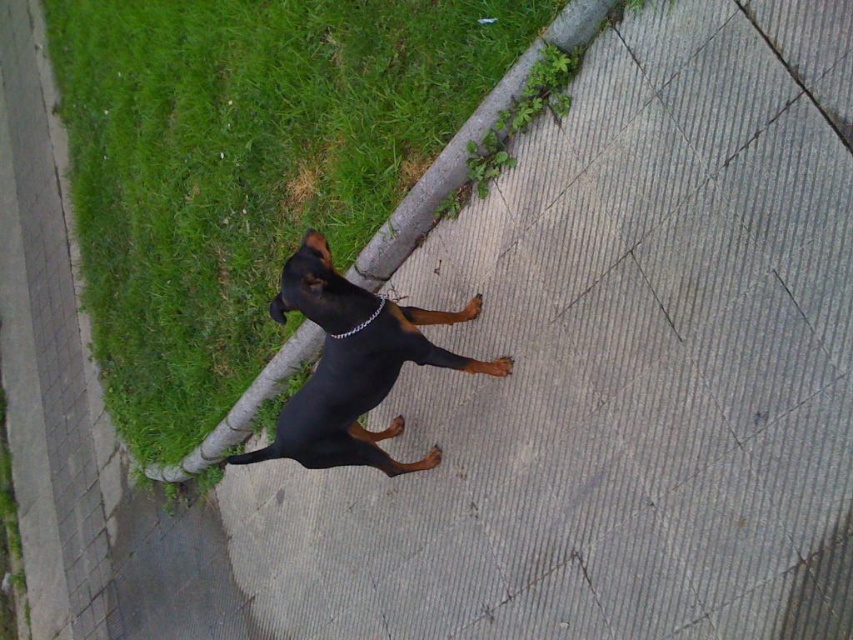
Question: Which of the following is the farthest from the observer?

Choices:
 (A) silver metallic chain at center
 (B) green grass at upper left
 (C) black smooth dog at center

Answer: (B)

Question: Based on their relative distances, which object is farther from the green grass at upper left?

Choices:
 (A) silver metallic chain at center
 (B) black smooth dog at center

Answer: (A)

Question: Can you confirm if green grass at upper left is smaller than silver metallic chain at center?

Choices:
 (A) yes
 (B) no

Answer: (B)

Question: From the image, what is the correct spatial relationship of green grass at upper left in relation to silver metallic chain at center?

Choices:
 (A) below
 (B) above

Answer: (B)

Question: Can you confirm if green grass at upper left is wider than silver metallic chain at center?

Choices:
 (A) yes
 (B) no

Answer: (A)

Question: Which of the following is the farthest from the observer?

Choices:
 (A) click(310, 280)
 (B) click(404, 141)

Answer: (B)